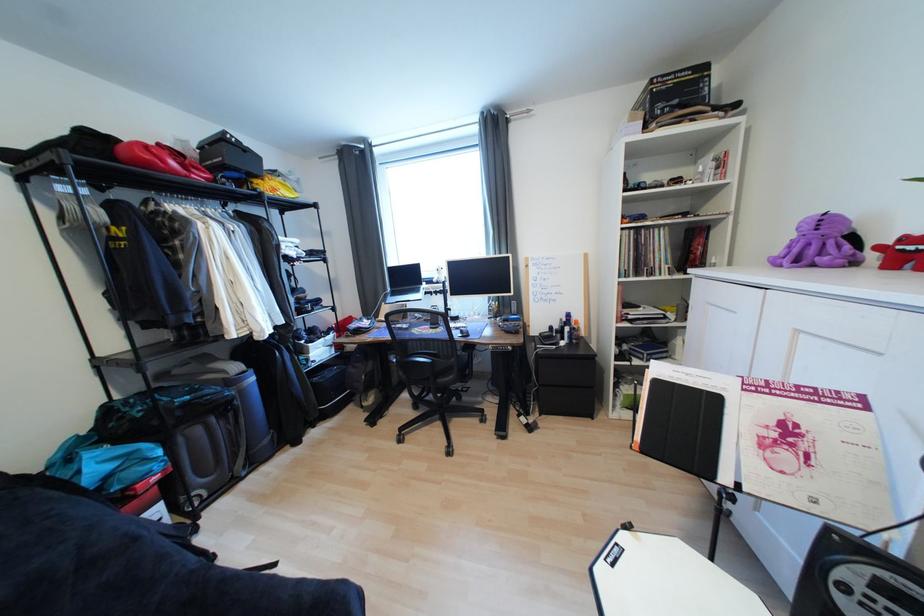
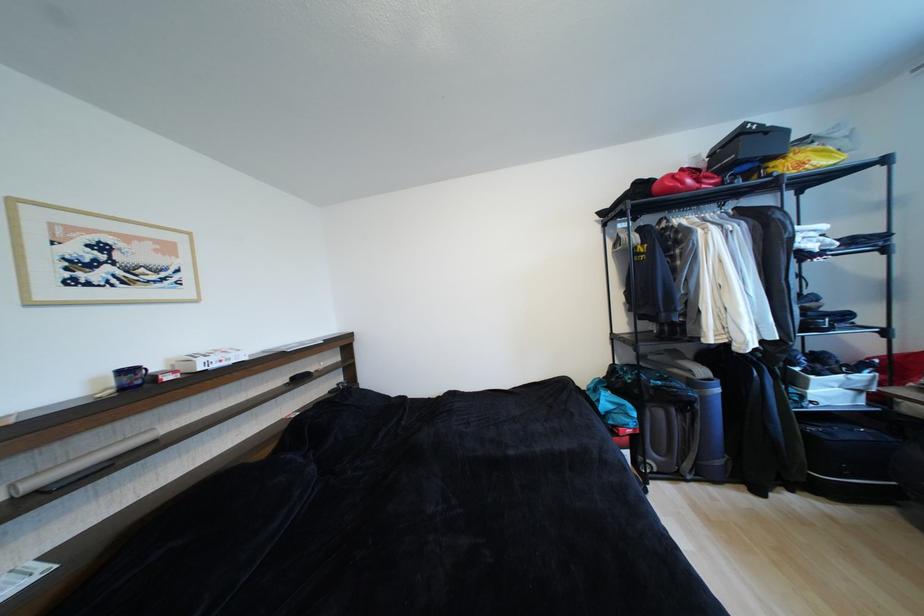
Question: The first image is from the beginning of the video and the second image is from the end. How did the camera likely rotate when shooting the video?

Choices:
 (A) Left
 (B) Right
 (C) Up
 (D) Down

Answer: (A)